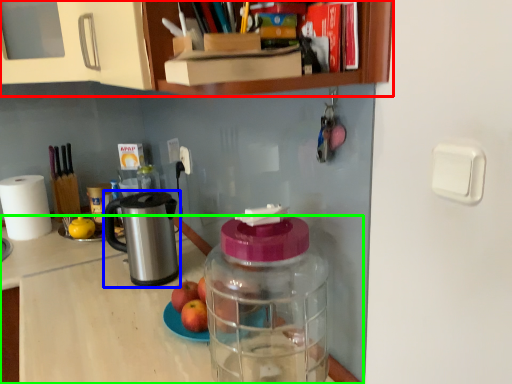
Question: Considering the real-world distances, which object is closest to cabinetry (highlighted by a red box)? appliance (highlighted by a blue box) or desk (highlighted by a green box).

Choices:
 (A) appliance
 (B) desk

Answer: (A)